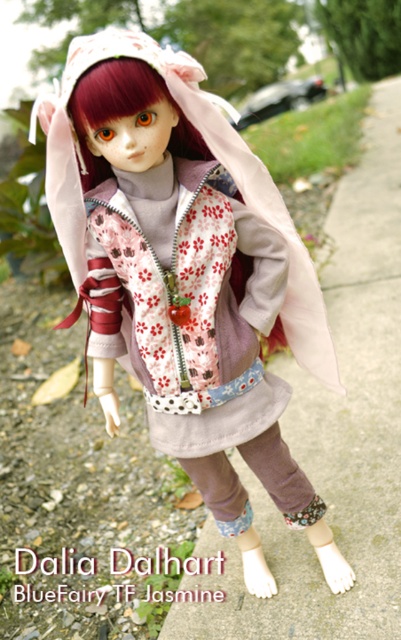
The image size is (401, 640). What do you see at coordinates (186, 276) in the screenshot?
I see `matte pink fabric at center` at bounding box center [186, 276].

Can you confirm if matte pink fabric at center is positioned to the left of gray concrete pavement at center?

Yes, matte pink fabric at center is to the left of gray concrete pavement at center.

Which is behind, point (101, 86) or point (396, 536)?

The point (396, 536) is behind.

Locate an element on the screen. This screenshot has width=401, height=640. matte pink fabric at center is located at coordinates (186, 276).